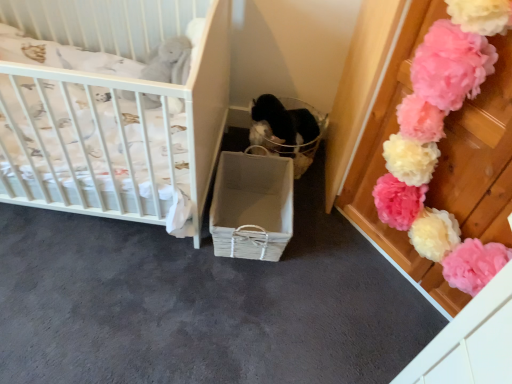
The width and height of the screenshot is (512, 384). In order to click on free space to the left of white wicker basket at center in this screenshot , I will do `click(144, 250)`.